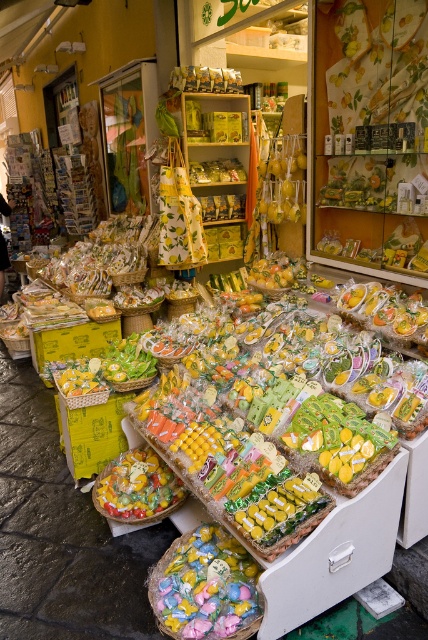
You are a customer at the lemon shop and want to buy a candy that takes up more space. Which one should you choose between the pastel candy at center and the translucent plastic candy at center?

The translucent plastic candy at center occupies more space than the pastel candy at center, so you should choose the translucent plastic candy at center.

You are a customer looking at the candies displayed in the shop. You see both the pastel candy at center and the translucent plastic candy at center. Which candy is positioned to the right side?

The pastel candy at center is positioned to the right of the translucent plastic candy at center.